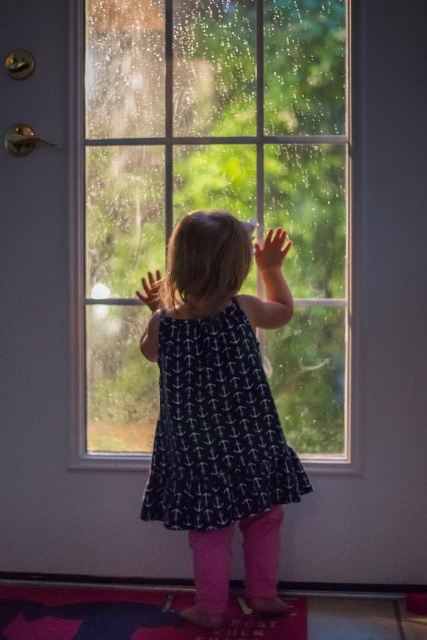
Can you confirm if clear glass window at center is wider than smooth skin hand at upper center?

Indeed, clear glass window at center has a greater width compared to smooth skin hand at upper center.

Who is taller, clear glass window at center or smooth skin hand at upper center?

clear glass window at center

Is point (146, 385) positioned in front of point (149, 307)?

No, it is behind (149, 307).

Where is `clear glass window at center`? The image size is (427, 640). clear glass window at center is located at coordinates (215, 196).

Is dark blue dress at center behind smooth skin hand at upper center?

No, dark blue dress at center is closer to the viewer.

Looking at this image, who is more distant from viewer, (x=166, y=368) or (x=146, y=288)?

Point (x=146, y=288)

Which is in front, point (222, 493) or point (146, 282)?

Point (222, 493)

The image size is (427, 640). In order to click on dark blue dress at center in this screenshot , I will do `click(219, 413)`.

Does transparent glass hand at upper center appear under smooth skin hand at upper center?

No.

This screenshot has height=640, width=427. Identify the location of transparent glass hand at upper center. (271, 250).